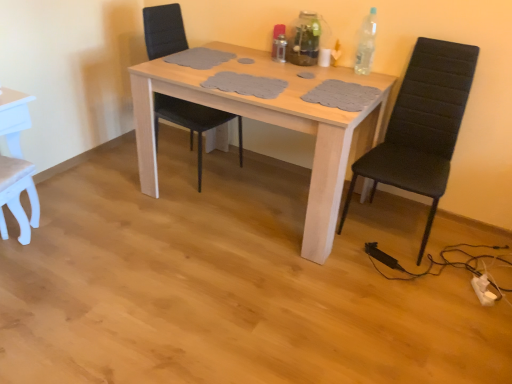
The height and width of the screenshot is (384, 512). Identify the location of free space to the left of light wood table at center. (114, 225).